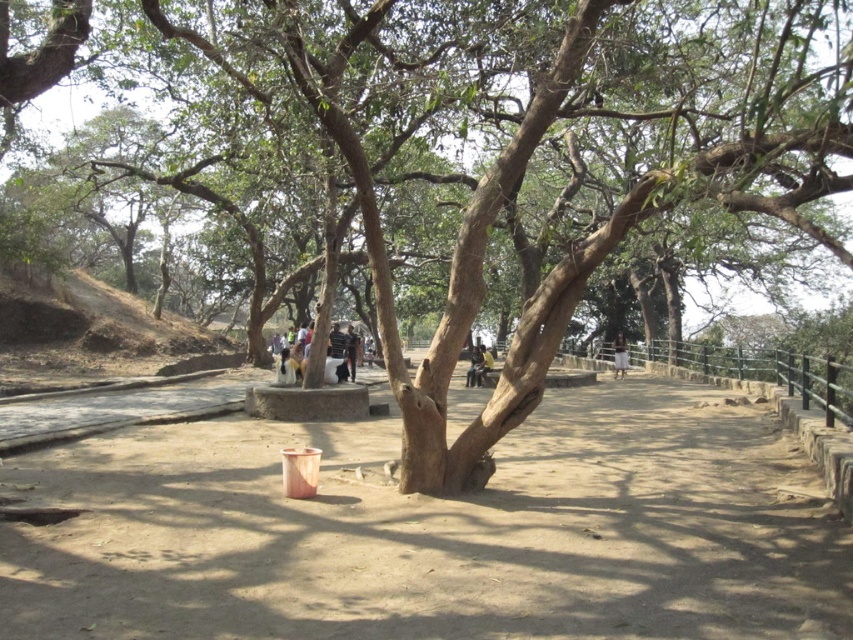
You are standing in the park and see the brown sandy dirt at center and the white cotton pants at center. Which object is taller?

The white cotton pants at center are taller than the brown sandy dirt at center.

You are a photographer standing in the park and want to take a picture of the large tree with the orange bucket. You notice the brown sandy dirt at center and the dark blue shirt at center in your frame. Which object is closer to the camera?

The dark blue shirt at center is closer to the camera because it is positioned over the brown sandy dirt at center, indicating it is in a more forward plane in the scene.